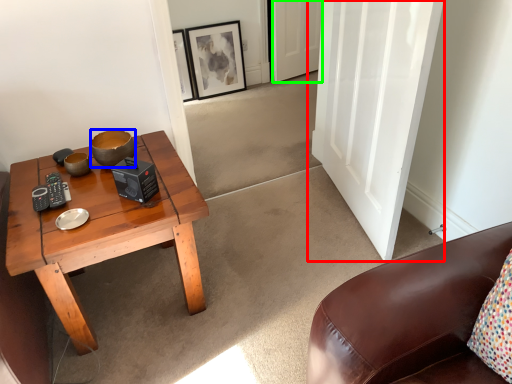
Question: Which object is positioned farthest from door (highlighted by a red box)? Select from bowl (highlighted by a blue box) and door (highlighted by a green box).

Choices:
 (A) bowl
 (B) door

Answer: (B)